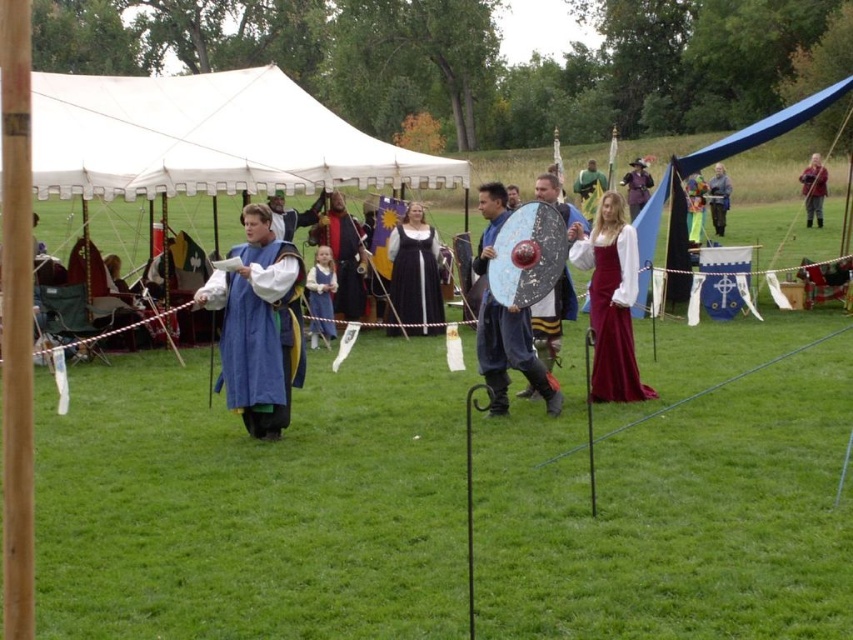
Is gray woolen coat at upper right closer to the viewer compared to purple velvet hat at upper center?

No, gray woolen coat at upper right is further to the viewer.

Between point (712, 166) and point (628, 209), which one is positioned in front?

Positioned in front is point (628, 209).

Which is in front, point (714, 204) or point (636, 164)?

Point (636, 164) is in front.

Where is `gray woolen coat at upper right`? This screenshot has width=853, height=640. gray woolen coat at upper right is located at coordinates (718, 196).

Based on the photo, who is shorter, velvet burgundy dress at center or silky red dress at center?

With less height is velvet burgundy dress at center.

Who is positioned more to the right, velvet burgundy dress at center or silky red dress at center?

silky red dress at center

Who is more distant from viewer, (x=608, y=257) or (x=688, y=224)?

Positioned behind is point (x=688, y=224).

You are a GUI agent. You are given a task and a screenshot of the screen. Output one action in this format:
    pyautogui.click(x=<x>, y=<y>)
    Task: Click on the velvet burgundy dress at center
    The image size is (853, 640).
    Given the screenshot: What is the action you would take?
    pyautogui.click(x=612, y=314)

Can you confirm if white canvas tent at center is shorter than matte black dress at center?

Incorrect, white canvas tent at center's height does not fall short of matte black dress at center's.

Is white canvas tent at center above matte black dress at center?

Correct, white canvas tent at center is located above matte black dress at center.

Where is `white canvas tent at center`? The height and width of the screenshot is (640, 853). white canvas tent at center is located at coordinates (206, 140).

The width and height of the screenshot is (853, 640). I want to click on white canvas tent at center, so click(206, 140).